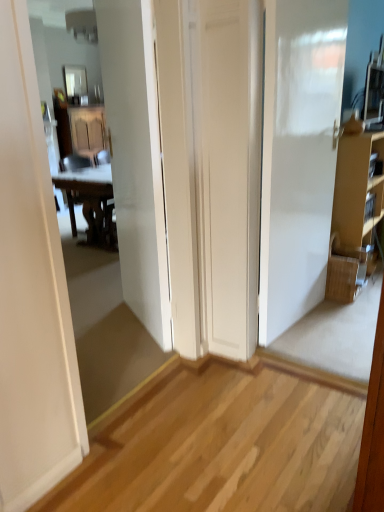
Identify the location of white glossy door at center. Image resolution: width=384 pixels, height=512 pixels. (136, 159).

What do you see at coordinates (75, 84) in the screenshot? I see `glossy glass mirror at upper center` at bounding box center [75, 84].

What are the coordinates of `wooden at left` in the screenshot? It's located at (90, 200).

From a real-world perspective, between woven brown picnic basket at right and brown cardboard cabinet at right, who is vertically higher?

brown cardboard cabinet at right, from a real-world perspective.

Is woven brown picnic basket at right in front of or behind brown cardboard cabinet at right in the image?

Clearly, woven brown picnic basket at right is in front of brown cardboard cabinet at right.

Which of these two, woven brown picnic basket at right or brown cardboard cabinet at right, is smaller?

woven brown picnic basket at right.

Considering the relative sizes of woven brown picnic basket at right and brown cardboard cabinet at right in the image provided, is woven brown picnic basket at right taller than brown cardboard cabinet at right?

No, woven brown picnic basket at right is not taller than brown cardboard cabinet at right.

Is wooden at left a part of white glossy door at center?

That's incorrect, wooden at left is not inside white glossy door at center.

From a real-world perspective, is white glossy door at center over wooden at left?

Answer: Yes, from a real-world perspective, white glossy door at center is on top of wooden at left.

Considering the sizes of objects brown cardboard cabinet at right and wooden at left in the image provided, who is taller, brown cardboard cabinet at right or wooden at left?

brown cardboard cabinet at right is taller.

Image resolution: width=384 pixels, height=512 pixels. In order to click on cabinetry that is in front of the wooden at left in this screenshot , I will do `click(358, 191)`.

Is brown cardboard cabinet at right facing away from wooden at left?

Absolutely, brown cardboard cabinet at right is directed away from wooden at left.

Between point (98, 210) and point (128, 289), which one is positioned behind?

The point (98, 210) is behind.

Considering the sizes of wooden at left and white glossy door at center in the image, is wooden at left bigger or smaller than white glossy door at center?

Clearly, wooden at left is larger in size than white glossy door at center.

Is wooden at left next to white glossy door at center and touching it?

They are not placed beside each other.

Considering the positions of objects wooden at left and white glossy door at center in the image provided, who is more to the right, wooden at left or white glossy door at center?

From the viewer's perspective, white glossy door at center appears more on the right side.

Which is in front, glossy glass mirror at upper center or white glossy door at center?

white glossy door at center is closer to the camera.

Is point (84, 87) positioned behind point (154, 249)?

That is True.

Can we say glossy glass mirror at upper center lies outside white glossy door at center?

Absolutely, glossy glass mirror at upper center is external to white glossy door at center.

Can you confirm if glossy glass mirror at upper center is wider than white glossy door at center?

Incorrect, the width of glossy glass mirror at upper center does not surpass that of white glossy door at center.

Can you confirm if brown cardboard cabinet at right is taller than white glossy door at center?

Incorrect, the height of brown cardboard cabinet at right is not larger of that of white glossy door at center.

Does point (342, 142) come closer to viewer compared to point (158, 287)?

No, (342, 142) is behind (158, 287).

Is brown cardboard cabinet at right far from white glossy door at center?

brown cardboard cabinet at right is far away from white glossy door at center.

Is the position of brown cardboard cabinet at right more distant than that of white glossy door at center?

Yes, brown cardboard cabinet at right is further from the camera.

Based on their sizes in the image, would you say woven brown picnic basket at right is bigger or smaller than white glossy door at center?

Considering their sizes, woven brown picnic basket at right takes up less space than white glossy door at center.

Consider the image. How different are the orientations of woven brown picnic basket at right and white glossy door at center in degrees?

The angle between the facing direction of woven brown picnic basket at right and the facing direction of white glossy door at center is 116 degrees.

From a real-world perspective, between woven brown picnic basket at right and white glossy door at center, who is vertically higher?

white glossy door at center, from a real-world perspective.

Considering the sizes of objects woven brown picnic basket at right and white glossy door at center in the image provided, who is taller, woven brown picnic basket at right or white glossy door at center?

Standing taller between the two is white glossy door at center.

You are a GUI agent. You are given a task and a screenshot of the screen. Output one action in this format:
    pyautogui.click(x=<x>, y=<y>)
    Task: Click on the picnic basket on the left of the brown cardboard cabinet at right
    The image size is (384, 512).
    Given the screenshot: What is the action you would take?
    pyautogui.click(x=345, y=271)

Where is `door below the wooden at left (from the image's perspective)`? The height and width of the screenshot is (512, 384). door below the wooden at left (from the image's perspective) is located at coordinates (136, 159).

From the image, which object appears to be nearer to woven brown picnic basket at right, glossy glass mirror at upper center or brown cardboard cabinet at right?

Based on the image, brown cardboard cabinet at right appears to be nearer to woven brown picnic basket at right.

When comparing their distances from white glossy door at center, does woven brown picnic basket at right or glossy glass mirror at upper center seem further?

glossy glass mirror at upper center is further to white glossy door at center.

Which object lies nearer to the anchor point woven brown picnic basket at right, white glossy door at center or wooden at left?

Among the two, white glossy door at center is located nearer to woven brown picnic basket at right.

Based on their spatial positions, is brown cardboard cabinet at right or glossy glass mirror at upper center further from woven brown picnic basket at right?

Based on the image, glossy glass mirror at upper center appears to be further to woven brown picnic basket at right.

Looking at this image, looking at the image, which one is located closer to woven brown picnic basket at right, white glossy door at center or brown cardboard cabinet at right?

brown cardboard cabinet at right is positioned closer to the anchor woven brown picnic basket at right.

Which object lies further to the anchor point brown cardboard cabinet at right, woven brown picnic basket at right or wooden at left?

wooden at left is further to brown cardboard cabinet at right.

Considering their positions, is brown cardboard cabinet at right positioned further to wooden at left than white glossy door at center?

Among the two, brown cardboard cabinet at right is located further to wooden at left.

From the image, which object appears to be nearer to wooden at left, woven brown picnic basket at right or white glossy door at center?

white glossy door at center.

The height and width of the screenshot is (512, 384). I want to click on cabinetry between white glossy door at center and glossy glass mirror at upper center along the z-axis, so click(358, 191).

At what (x,y) coordinates should I click in order to perform the action: click on picnic basket positioned between white glossy door at center and glossy glass mirror at upper center from near to far. Please return your answer as a coordinate pair (x, y). Looking at the image, I should click on (345, 271).

Find the location of a particular element. This screenshot has height=512, width=384. chair between white glossy door at center and glossy glass mirror at upper center in the front-back direction is located at coordinates (90, 200).

Find the location of `chair between brown cardboard cabinet at right and glossy glass mirror at upper center from front to back`. chair between brown cardboard cabinet at right and glossy glass mirror at upper center from front to back is located at coordinates (90, 200).